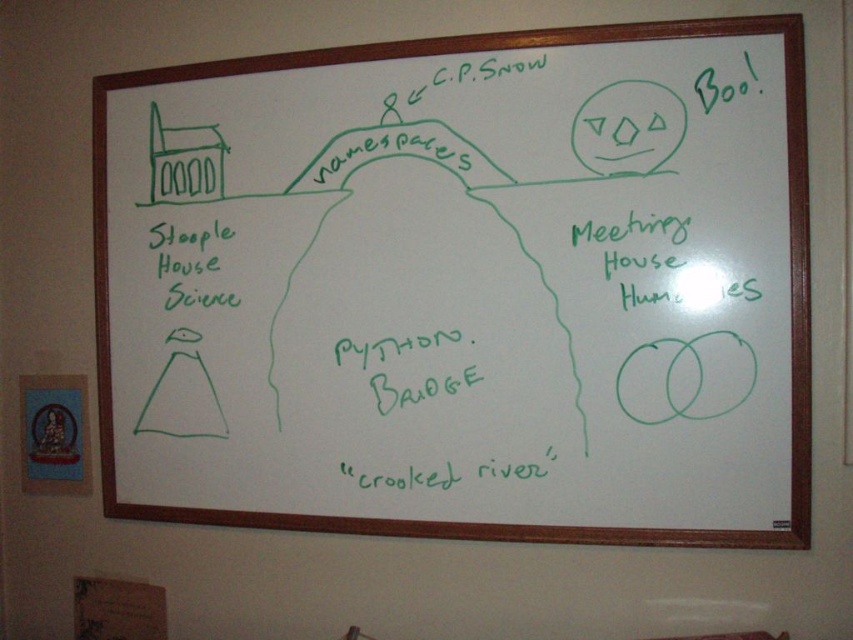
You are standing in front of the whiteboard and want to touch the point at coordinates point [679,275]. Can you reach it without moving your hand more than 4 feet? Explain why or why not.

The distance between point [679,275] and the viewer is 4.09 feet. Since 4.09 feet is slightly more than 4 feet, you cannot reach it without moving your hand more than 4 feet.

Consider the image. You are standing in front of the whiteboard at upper center and want to write a note on the green marker text at left. Can you do this without moving the whiteboard?

The whiteboard at upper center is in front of the green marker text at left, so you cannot write on the green marker text at left without moving the whiteboard first because it is obstructed.